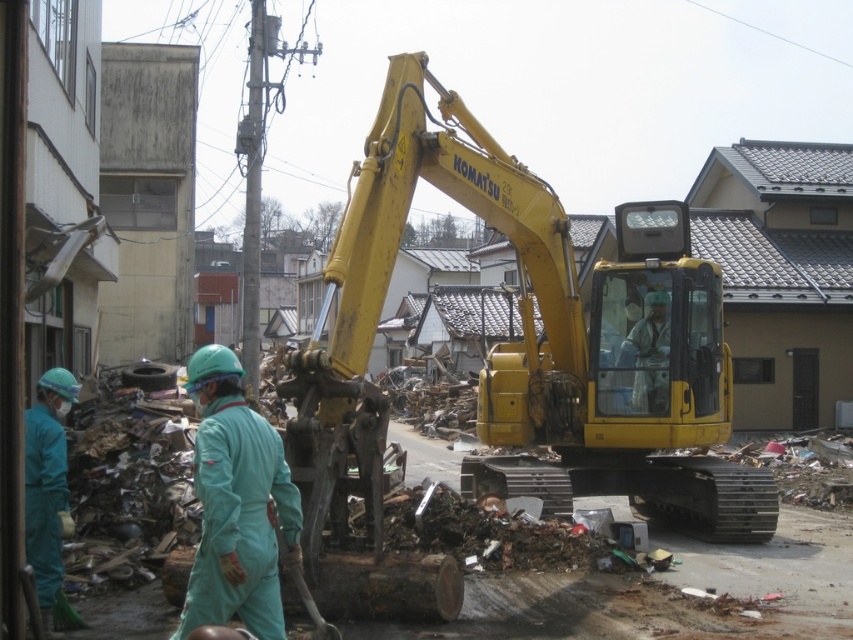
You are a drone operator tasked with capturing aerial footage of the yellow metallic excavator at center. The drone is currently at point A. To ensure safety, you must keep the drone at least 10 meters away from the excavator. Given the coordinates of the excavator at point B, which is at point C, can you determine if the drone is within the safe distance?

The question mentions coordinates but does not provide the coordinates of the drone or the distance between point A and point B. Without this information, it is impossible to determine if the drone is within the safe distance.

You are a safety inspector at the demolition site. You need to ensure that the yellow metallic excavator at center and the light blue fabric at center are at least 1 meter apart for safety regulations. Based on the scene, are they compliant with the safety distance requirement?

The yellow metallic excavator at center and the light blue fabric at center are 90.29 centimeters apart from each other. Since 90.29 centimeters is less than 1 meter, they are not compliant with the safety distance requirement.

You are a safety inspector at the demolition site. You need to ensure that the yellow metallic excavator at center can move freely between the teal fabric uniform at left and the debris pile on the right. Based on their sizes, can the excavator navigate through the space between them?

The yellow metallic excavator at center is wider than the teal fabric uniform at left, so it may not be able to navigate through the space between them without risking collision or obstruction.